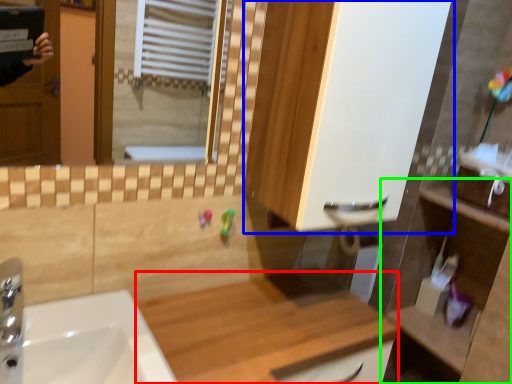
Question: Based on their relative distances, which object is farther from counter top (highlighted by a red box)? Choose from cabinetry (highlighted by a blue box) and counter (highlighted by a green box).

Choices:
 (A) cabinetry
 (B) counter

Answer: (A)